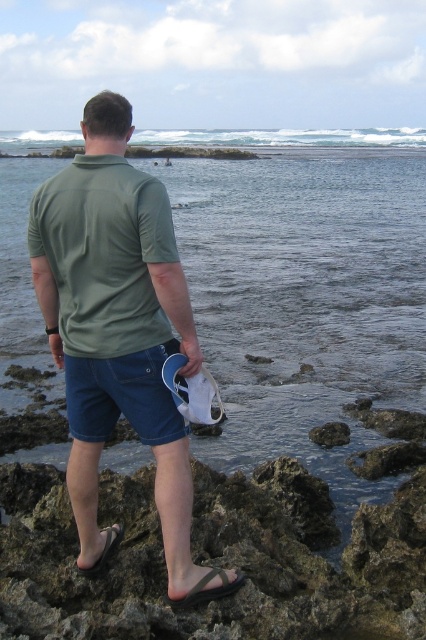
You are a photographer trying to capture the perfect shot of the black rubber sandal at lower center and the black rubber sandal at lower left. Which sandal should you focus on first if you want to ensure both are in sharp focus without moving the camera?

You should focus on the black rubber sandal at lower center first because it is closer to the viewer, so adjusting the focus to this sandal will help ensure both are in sharp focus when using a small aperture or depth of field technique.

You are a photographer trying to capture the clear water at center and the denim shorts at lower center in the same frame. Which object should you focus on first to ensure both are in focus?

The clear water at center is further to the viewer than the denim shorts at lower center, so you should focus on the clear water at center first to ensure both are in focus.

You are navigating a drone along the rocky terrain in the scene. The drone must fly from point A to point B. If point A is at point (322, 288) and point B is at point (157, 429), will the drone have to go around any obstacles between them?

Point (322, 288) is behind point (157, 429), so the drone will not need to go around any obstacles between them as the path is clear.